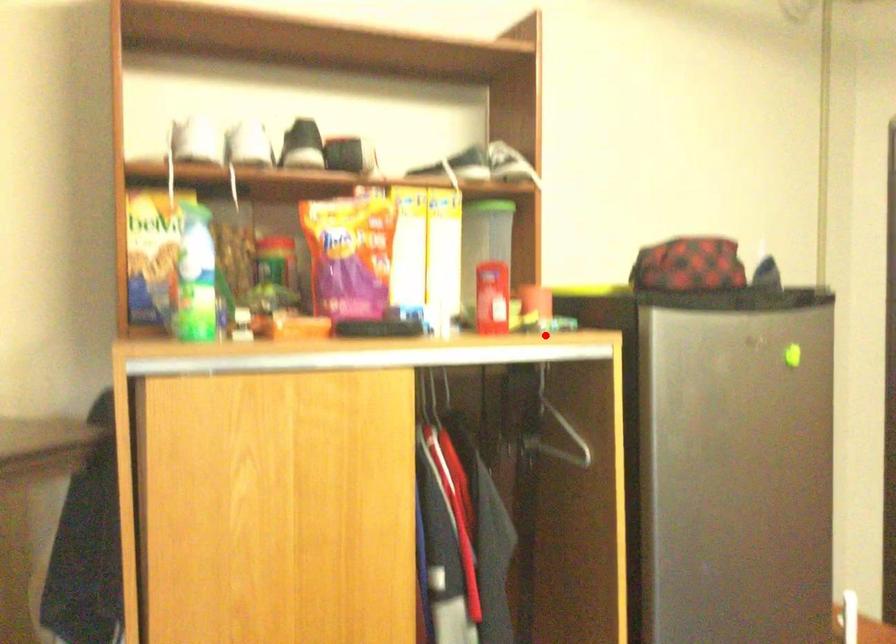
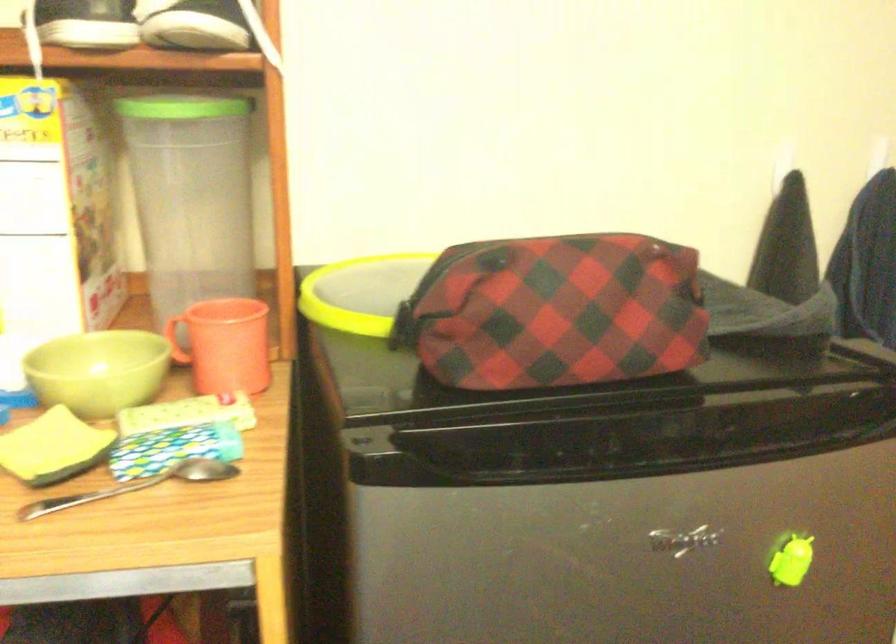
Question: I am providing you with two images of the same scene from different viewpoints. A red point is shown in image1. For the corresponding object point in image2, is it positioned nearer or farther from the camera?

Choices:
 (A) Nearer
 (B) Farther

Answer: (A)